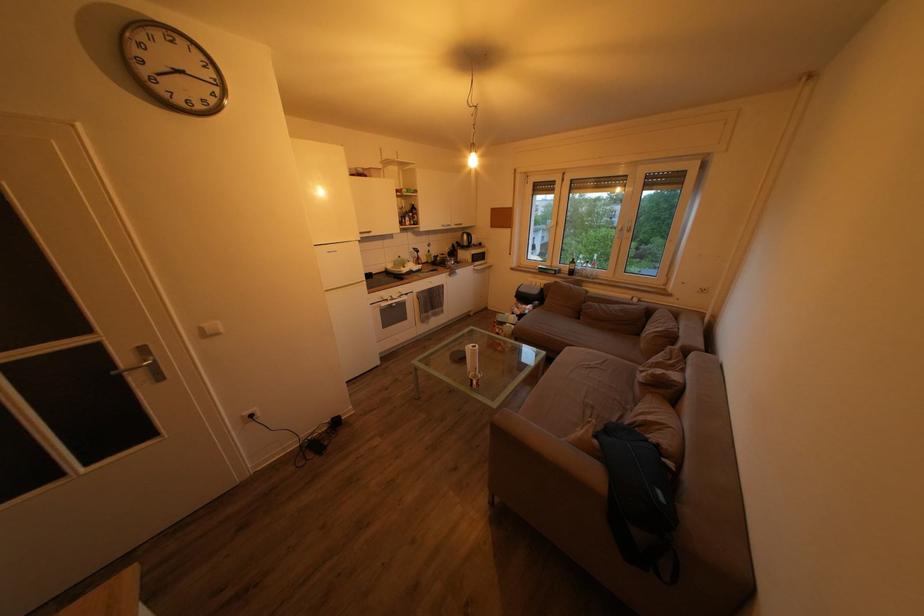
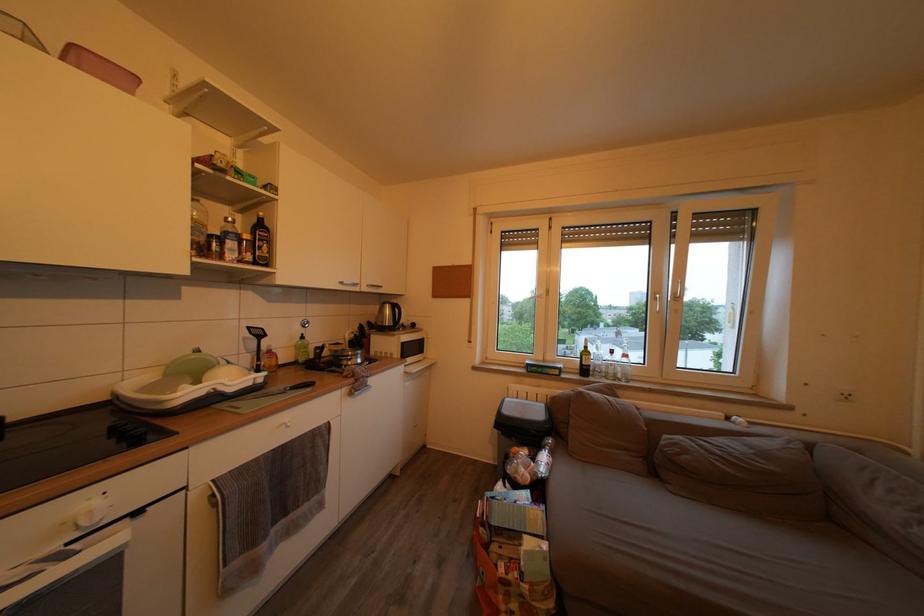
Locate, in the second image, the point that corresponds to point (419, 221) in the first image.

(253, 243)